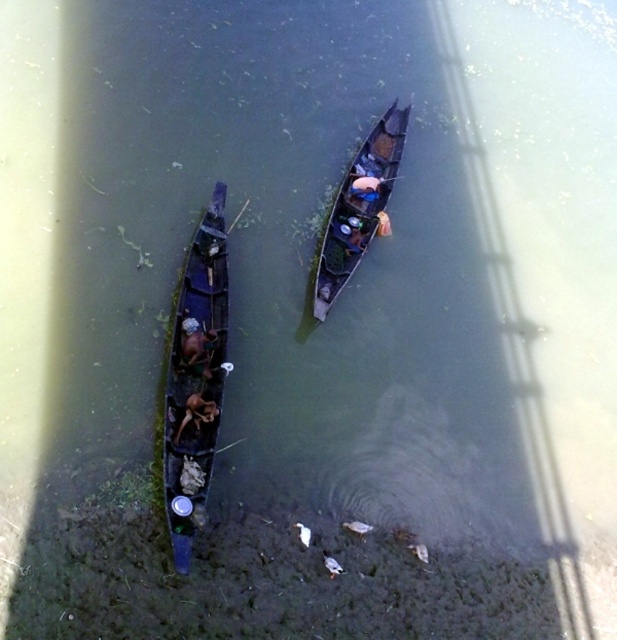
Question: Which of the following is the closest to the observer?

Choices:
 (A) dark brown wooden boat at center
 (B) dark wood canoe at left

Answer: (B)

Question: Can you confirm if dark wood boat at center is smaller than dark brown wooden boat at center?

Choices:
 (A) yes
 (B) no

Answer: (B)

Question: Is dark wood canoe at left behind dark brown wooden boat at center?

Choices:
 (A) no
 (B) yes

Answer: (A)

Question: Estimate the real-world distances between objects in this image. Which object is farther from the dark wood boat at center?

Choices:
 (A) dark wood canoe at left
 (B) dark brown wooden boat at center

Answer: (B)

Question: Can you confirm if dark wood canoe at left is positioned below dark brown wooden boat at center?

Choices:
 (A) yes
 (B) no

Answer: (B)

Question: Which is nearer to the dark brown wooden boat at center?

Choices:
 (A) dark wood boat at center
 (B) dark wood canoe at left

Answer: (B)